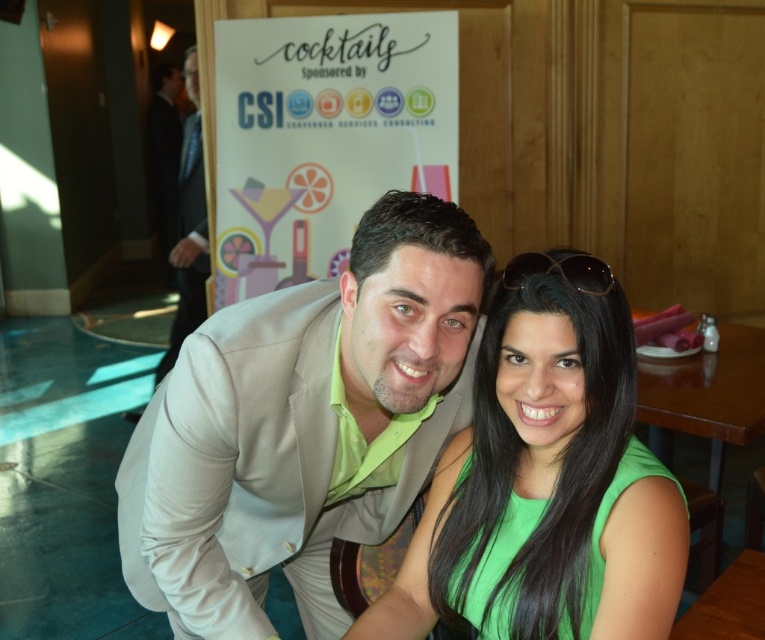
Does black suit at left come in front of wooden at center?

No, it is not.

Is black suit at left thinner than wooden at center?

No, black suit at left is not thinner than wooden at center.

The height and width of the screenshot is (640, 765). I want to click on black suit at left, so click(187, 227).

Find the location of a particular element. This screenshot has width=765, height=640. black suit at left is located at coordinates (187, 227).

Looking at this image, does light beige suit at center have a greater width compared to sunglasses at upper center?

Yes.

Does light beige suit at center lie in front of sunglasses at upper center?

Yes, it is in front of sunglasses at upper center.

Is point (233, 317) in front of point (557, 259)?

No, it is not.

At what (x,y) coordinates should I click in order to perform the action: click on light beige suit at center. Please return your answer as a coordinate pair (x, y). Looking at the image, I should click on (301, 426).

Does light beige suit at center have a greater height compared to black suit at left?

In fact, light beige suit at center may be shorter than black suit at left.

Is the position of light beige suit at center less distant than that of black suit at left?

Yes, it is in front of black suit at left.

Is point (334, 509) behind point (194, 125)?

That is False.

Where is `light beige suit at center`? Image resolution: width=765 pixels, height=640 pixels. light beige suit at center is located at coordinates (301, 426).